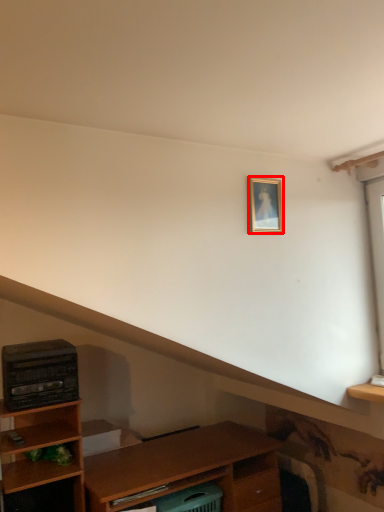
Question: Observing the image, what is the correct spatial positioning of picture frame (annotated by the red box) in reference to appliance?

Choices:
 (A) left
 (B) right

Answer: (B)